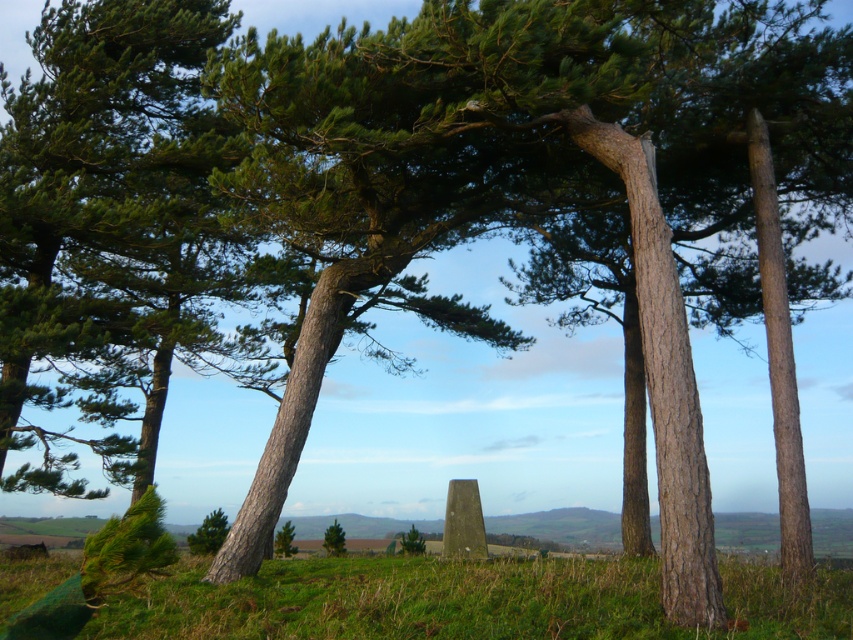
Can you confirm if green rough bark tree at lower center is smaller than green matte tree at lower left?

Actually, green rough bark tree at lower center might be larger than green matte tree at lower left.

Between green rough bark tree at lower center and green matte tree at lower left, which one is positioned lower?

Positioned lower is green rough bark tree at lower center.

Which is behind, point (335, 529) or point (285, 545)?

The point (335, 529) is behind.

Image resolution: width=853 pixels, height=640 pixels. I want to click on green rough bark tree at lower center, so click(334, 540).

Based on the photo, who is more forward, (178, 616) or (288, 548)?

Point (178, 616) is in front.

Does green grassy at lower left have a smaller size compared to green matte tree at lower left?

Incorrect, green grassy at lower left is not smaller in size than green matte tree at lower left.

This screenshot has height=640, width=853. What are the coordinates of `green grassy at lower left` in the screenshot? It's located at (398, 600).

Between green grassy at lower left and green rough bark tree at lower center, which one is positioned higher?

green grassy at lower left is above.

Does green grassy at lower left have a smaller size compared to green rough bark tree at lower center?

Incorrect, green grassy at lower left is not smaller in size than green rough bark tree at lower center.

Which is in front, point (328, 609) or point (326, 531)?

Positioned in front is point (328, 609).

Identify the location of green grassy at lower left. The image size is (853, 640). (398, 600).